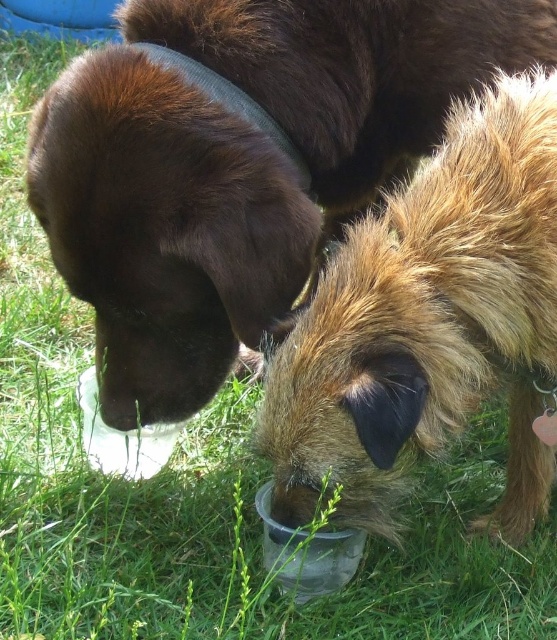
Consider the image. You are a photographer trying to capture a closeup of the brown matte fur at center. According to the coordinates provided, where should you position your camera to get the best shot?

The brown matte fur at center is located at coordinates point (240, 164), so positioning the camera at that point would ensure the best closeup shot.

You are a photographer trying to capture the dogs from above. Which dog has the brown matte fur at center located above the fuzzy brown fur at lower center?

The brown matte fur at center is above the fuzzy brown fur at lower center, so the dog with the brown matte fur at center is the one on the left, the chocolate Labrador Retriever.